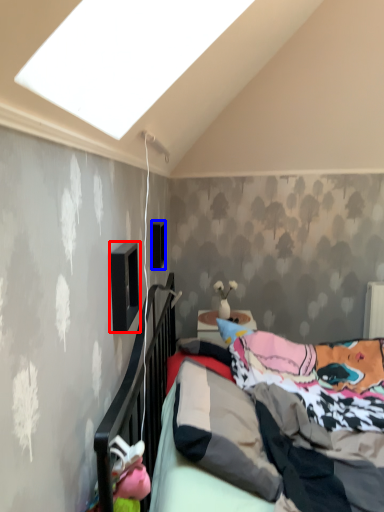
Question: Which of the following is the farthest to the observer, window (highlighted by a red box) or window (highlighted by a blue box)?

Choices:
 (A) window
 (B) window

Answer: (B)